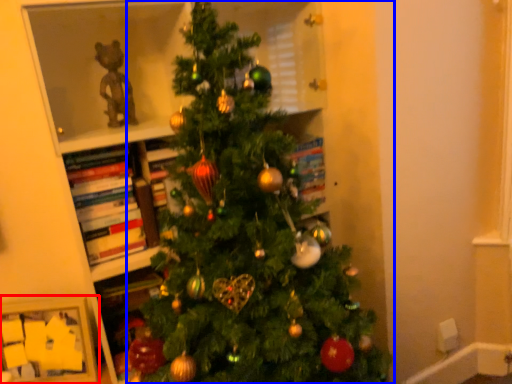
Question: Which object is closer to the camera taking this photo, picture frame (highlighted by a red box) or christmas tree (highlighted by a blue box)?

Choices:
 (A) picture frame
 (B) christmas tree

Answer: (B)